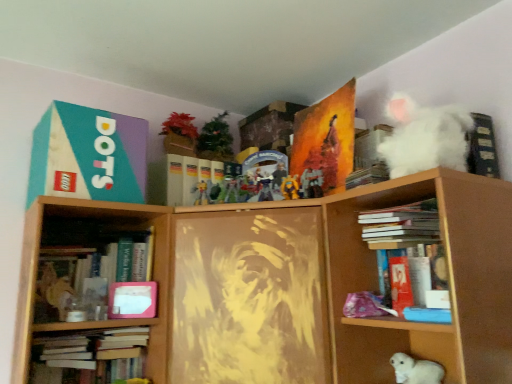
Question: From a real-world perspective, is orange matte painting at upper center, acting as the second paperback book starting from the left, physically located above or below matte plastic action figure at center, which ranks as the first toy in back-to-front order?

Choices:
 (A) above
 (B) below

Answer: (A)

Question: Does point click(x=314, y=120) appear closer or farther from the camera than point click(x=199, y=198)?

Choices:
 (A) closer
 (B) farther

Answer: (B)

Question: Which of these objects is positioned closest to the white matte book at upper right, which is the third book from bottom to top?

Choices:
 (A) hardcover book at lower left, positioned as the 5th book in top-to-bottom order
 (B) white fluffy cat at lower right, which ranks as the fourth toy in left-to-right order
 (C) matte plastic action figure at center, which appears as the first toy when viewed from the left
 (D) hardcover book at center, arranged as the third book when viewed from the left
 (E) hardcover book at upper center, which appears as the 2th book when viewed from the right

Answer: (E)

Question: Which is nearer to the white matte book at center?

Choices:
 (A) hardcover book at upper center, the 1th book from the top
 (B) orange matte painting at upper center, acting as the second paperback book starting from the left
 (C) hardcover book at left, the second book when ordered from left to right
 (D) hardcover book at center, marked as the 3th book in a right-to-left arrangement
 (E) yellow matte toy at center, which ranks as the fourth toy in bottom-to-top order

Answer: (C)